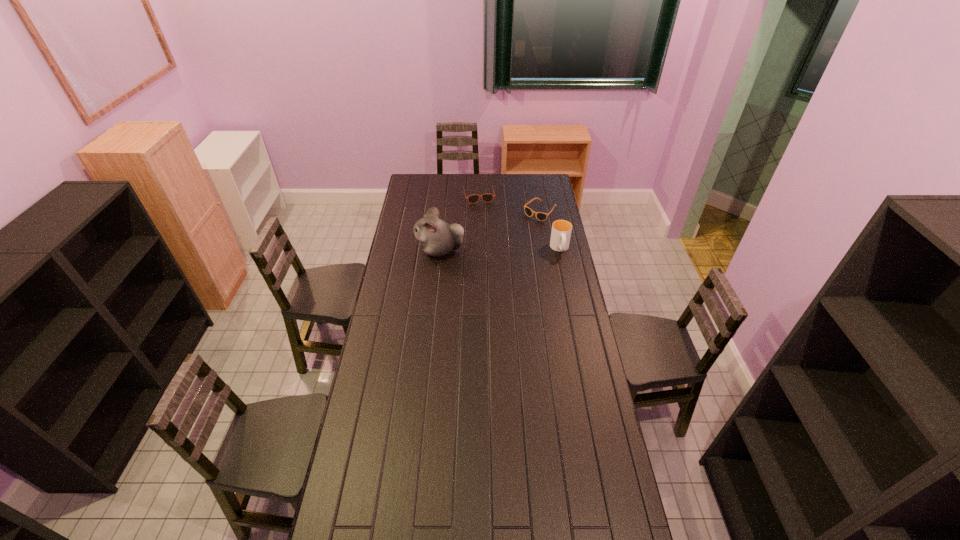
You are a GUI agent. You are given a task and a screenshot of the screen. Output one action in this format:
    pyautogui.click(x=<x>, y=<y>)
    Task: Click on the free space on the desktop that is between the tallest object and the cup and is positioned on the front-facing side of the left sunglasses
    
    Given the screenshot: What is the action you would take?
    pyautogui.click(x=492, y=249)

You are a GUI agent. You are given a task and a screenshot of the screen. Output one action in this format:
    pyautogui.click(x=<x>, y=<y>)
    Task: Click on the free space on the desktop that is between the hamster and the second tallest object and is positioned on the front-facing side of the right sunglasses
    The image size is (960, 540).
    Given the screenshot: What is the action you would take?
    pyautogui.click(x=501, y=249)